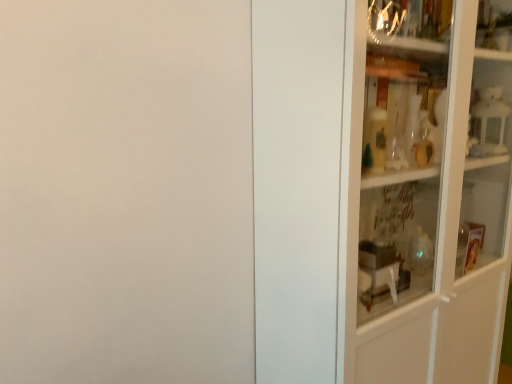
Describe the element at coordinates (426, 191) in the screenshot. I see `white glossy cupboard at right` at that location.

Locate an element on the screen. The width and height of the screenshot is (512, 384). white glossy cupboard at right is located at coordinates (426, 191).

The image size is (512, 384). I want to click on white glossy cupboard at right, so click(x=426, y=191).